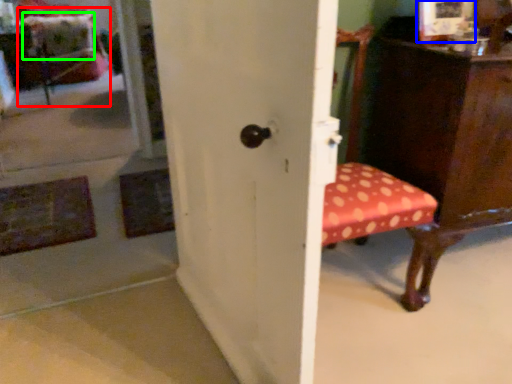
Question: Estimate the real-world distances between objects in this image. Which object is farther from swivel chair (highlighted by a red box), picture frame (highlighted by a blue box) or pillow (highlighted by a green box)?

Choices:
 (A) picture frame
 (B) pillow

Answer: (A)